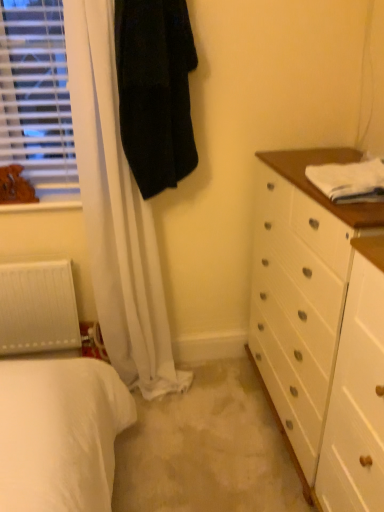
Identify the location of white matte radiator at lower left. The width and height of the screenshot is (384, 512). (38, 308).

The width and height of the screenshot is (384, 512). Describe the element at coordinates (349, 180) in the screenshot. I see `white cotton towel at upper right` at that location.

What is the approximate height of white cotton towel at upper right?

white cotton towel at upper right is 10.54 centimeters in height.

What do you see at coordinates (15, 186) in the screenshot? I see `brown leather dog at left` at bounding box center [15, 186].

The image size is (384, 512). Identify the location of black fuzzy coat at upper left. (155, 91).

The width and height of the screenshot is (384, 512). I want to click on white matte radiator at lower left, so click(x=38, y=308).

Considering the sizes of objects white matte radiator at lower left and brown leather dog at left in the image provided, who is bigger, white matte radiator at lower left or brown leather dog at left?

white matte radiator at lower left is bigger.

Is brown leather dog at left inside white matte radiator at lower left?

No, brown leather dog at left is not a part of white matte radiator at lower left.

Between white matte radiator at lower left and brown leather dog at left, which one has less height?

brown leather dog at left is shorter.

You are a GUI agent. You are given a task and a screenshot of the screen. Output one action in this format:
    pyautogui.click(x=<x>, y=<y>)
    Task: Click on the radiator below the brown leather dog at left (from the image's perspective)
    The width and height of the screenshot is (384, 512).
    Given the screenshot: What is the action you would take?
    pyautogui.click(x=38, y=308)

Is the depth of white cotton towel at upper right greater than that of brown leather dog at left?

No.

Consider the image. From the image's perspective, is white cotton towel at upper right located beneath brown leather dog at left?

Yes, from the image's perspective, white cotton towel at upper right is beneath brown leather dog at left.

Considering the relative sizes of white cotton towel at upper right and brown leather dog at left in the image provided, is white cotton towel at upper right thinner than brown leather dog at left?

In fact, white cotton towel at upper right might be wider than brown leather dog at left.

Is wooden frame at left positioned with its back to brown leather dog at left?

No, wooden frame at left is not facing the opposite direction of brown leather dog at left.

Is wooden frame at left next to brown leather dog at left?

Yes, wooden frame at left and brown leather dog at left clearly make contact.

Which object is further away from the camera taking this photo, wooden frame at left or brown leather dog at left?

wooden frame at left is further away from the camera.

Does point (48, 206) come farther from viewer compared to point (6, 169)?

Yes, point (48, 206) is farther from viewer.

From the image's perspective, is white matte radiator at lower left located above wooden frame at left?

No.

In order to click on window sill in front of the white matte radiator at lower left in this screenshot , I will do `click(44, 204)`.

Looking at this image, from a real-world perspective, is white matte radiator at lower left above or below wooden frame at left?

white matte radiator at lower left is below wooden frame at left.

Based on their sizes in the image, would you say brown leather dog at left is bigger or smaller than wooden frame at left?

brown leather dog at left is smaller than wooden frame at left.

Locate an element on the screen. The height and width of the screenshot is (512, 384). window sill to the right of brown leather dog at left is located at coordinates (44, 204).

Does brown leather dog at left appear on the right side of wooden frame at left?

No.

Does brown leather dog at left have a greater width compared to wooden frame at left?

Incorrect, the width of brown leather dog at left does not surpass that of wooden frame at left.

In the image, is black fuzzy coat at upper left positioned in front of or behind wooden frame at left?

In the image, black fuzzy coat at upper left appears in front of wooden frame at left.

How much distance is there between black fuzzy coat at upper left and wooden frame at left?

black fuzzy coat at upper left and wooden frame at left are 56.28 centimeters apart.

In terms of height, does black fuzzy coat at upper left look taller or shorter compared to wooden frame at left?

In the image, black fuzzy coat at upper left appears to be taller than wooden frame at left.

Is wooden frame at left surrounded by black fuzzy coat at upper left?

Actually, wooden frame at left is outside black fuzzy coat at upper left.

Is brown leather dog at left at the right side of white matte radiator at lower left?

In fact, brown leather dog at left is to the left of white matte radiator at lower left.

Is brown leather dog at left wider than white matte radiator at lower left?

Incorrect, the width of brown leather dog at left does not surpass that of white matte radiator at lower left.

Can you tell me how much brown leather dog at left and white matte radiator at lower left differ in facing direction?

The angle between the facing direction of brown leather dog at left and the facing direction of white matte radiator at lower left is 0.962 degrees.

Is brown leather dog at left behind white matte radiator at lower left?

No, brown leather dog at left is closer to the viewer.

Where is `animal in front of the white matte radiator at lower left`? The height and width of the screenshot is (512, 384). animal in front of the white matte radiator at lower left is located at coordinates (15, 186).

Where is `sheet above the brown leather dog at left (from a real-world perspective)`? The image size is (384, 512). sheet above the brown leather dog at left (from a real-world perspective) is located at coordinates (349, 180).

Considering their positions, is brown leather dog at left positioned further to black fuzzy coat at upper left than white matte radiator at lower left?

Among the two, white matte radiator at lower left is located further to black fuzzy coat at upper left.

When comparing their distances from white cotton towel at upper right, does black fuzzy coat at upper left or white matte radiator at lower left seem further?

white matte radiator at lower left is further to white cotton towel at upper right.

Based on their spatial positions, is black fuzzy coat at upper left or white cotton towel at upper right further from brown leather dog at left?

Based on the image, white cotton towel at upper right appears to be further to brown leather dog at left.

Based on their spatial positions, is black fuzzy coat at upper left or white cotton towel at upper right further from wooden frame at left?

Based on the image, white cotton towel at upper right appears to be further to wooden frame at left.

Estimate the real-world distances between objects in this image. Which object is closer to white matte radiator at lower left, white cotton towel at upper right or black fuzzy coat at upper left?

Answer: black fuzzy coat at upper left is positioned closer to the anchor white matte radiator at lower left.

Based on their spatial positions, is brown leather dog at left or wooden frame at left further from black fuzzy coat at upper left?

brown leather dog at left lies further to black fuzzy coat at upper left than the other object.

Based on their spatial positions, is white cotton towel at upper right or black fuzzy coat at upper left further from brown leather dog at left?

white cotton towel at upper right.

Considering their positions, is brown leather dog at left positioned closer to white cotton towel at upper right than wooden frame at left?

wooden frame at left.

Where is `clothing between white matte radiator at lower left and white cotton towel at upper right`? This screenshot has width=384, height=512. clothing between white matte radiator at lower left and white cotton towel at upper right is located at coordinates (155, 91).

Locate an element on the screen. clothing located between wooden frame at left and white cotton towel at upper right in the left-right direction is located at coordinates (155, 91).

This screenshot has height=512, width=384. Find the location of `radiator located between brown leather dog at left and white cotton towel at upper right in the left-right direction`. radiator located between brown leather dog at left and white cotton towel at upper right in the left-right direction is located at coordinates (38, 308).

Identify the location of window sill between white matte radiator at lower left and white cotton towel at upper right in the horizontal direction. The height and width of the screenshot is (512, 384). (44, 204).